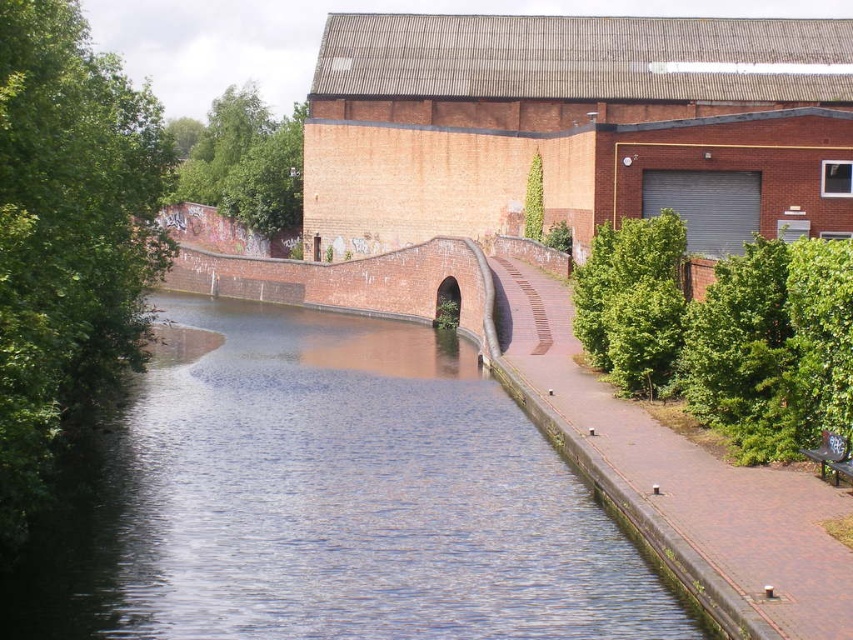
Which is more to the left, blue water at center or brick/rough bridge at center?

brick/rough bridge at center

Does point (242, 509) come farther from viewer compared to point (229, 291)?

No, (242, 509) is in front of (229, 291).

Identify the location of blue water at center. (328, 500).

From the picture: Can you confirm if brick pavement at center is wider than brick/rough bridge at center?

In fact, brick pavement at center might be narrower than brick/rough bridge at center.

Can you confirm if brick pavement at center is positioned above brick/rough bridge at center?

No, brick pavement at center is not above brick/rough bridge at center.

Is point (578, 372) in front of point (181, 276)?

Yes, it is.

At what (x,y) coordinates should I click in order to perform the action: click on brick pavement at center. Please return your answer as a coordinate pair (x, y). Looking at the image, I should click on (686, 474).

Is blue water at center closer to camera compared to brick pavement at center?

No.

Can you confirm if blue water at center is thinner than brick pavement at center?

Incorrect, blue water at center's width is not less than brick pavement at center's.

Which is in front, point (595, 531) or point (544, 371)?

Point (595, 531) is in front.

Where is `blue water at center`? This screenshot has height=640, width=853. blue water at center is located at coordinates (328, 500).